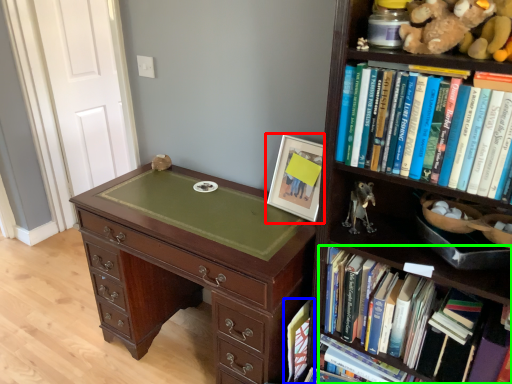
Question: Estimate the real-world distances between objects in this image. Which object is closer to picture frame (highlighted by a red box), book (highlighted by a blue box) or book (highlighted by a green box)?

Choices:
 (A) book
 (B) book

Answer: (B)